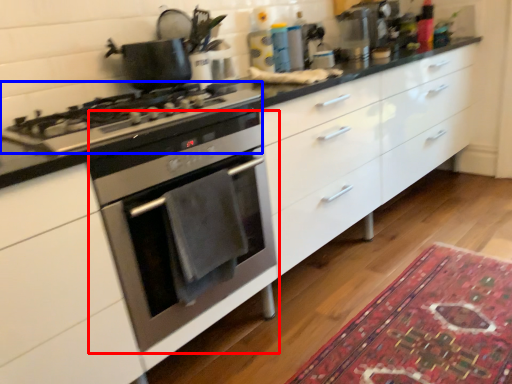
Question: Among these objects, which one is nearest to the camera, oven (highlighted by a red box) or gas stove (highlighted by a blue box)?

Choices:
 (A) oven
 (B) gas stove

Answer: (B)